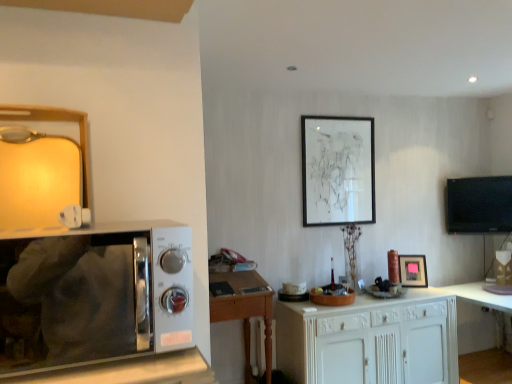
Describe the element at coordinates (244, 310) in the screenshot. I see `wooden desk at center` at that location.

Locate an element on the screen. This screenshot has width=512, height=384. white wood cabinet at center is located at coordinates (370, 340).

Where is `matte black picture frame at center, the 1th picture frame when ordered from bottom to top`? The height and width of the screenshot is (384, 512). matte black picture frame at center, the 1th picture frame when ordered from bottom to top is located at coordinates (413, 270).

Describe the element at coordinates (413, 270) in the screenshot. I see `matte black picture frame at center, which is counted as the 2th picture frame, starting from the left` at that location.

What do you see at coordinates (479, 205) in the screenshot? The height and width of the screenshot is (384, 512). I see `black glossy tv at right` at bounding box center [479, 205].

Locate an element on the screen. Image resolution: width=512 pixels, height=384 pixels. white glossy table at lower right is located at coordinates (481, 296).

Considering the relative sizes of sleek silver microwave at left and black glossy tv at right in the image provided, is sleek silver microwave at left bigger than black glossy tv at right?

Yes.

Does sleek silver microwave at left turn towards black glossy tv at right?

No, sleek silver microwave at left is not turned towards black glossy tv at right.

Can you confirm if sleek silver microwave at left is wider than black glossy tv at right?

Yes.

Who is more distant, sleek silver microwave at left or black glossy tv at right?

Positioned behind is black glossy tv at right.

Between wooden desk at center and matte black picture frame at upper center, which appears as the 1th picture frame when viewed from the left, which one has less height?

Standing shorter between the two is wooden desk at center.

Considering the points (240, 311) and (338, 219), which point is behind, point (240, 311) or point (338, 219)?

The point (338, 219) is more distant.

From the image's perspective, who appears lower, wooden desk at center or matte black picture frame at upper center, which appears as the 1th picture frame when viewed from the left?

wooden desk at center is shown below in the image.

Which object is thinner, wooden desk at center or matte black picture frame at upper center, which is counted as the 1th picture frame, starting from the top?

matte black picture frame at upper center, which is counted as the 1th picture frame, starting from the top.

From a real-world perspective, is white wood cabinet at center positioned above or below matte black picture frame at upper center, which appears as the 1th picture frame when viewed from the left?

From a real-world perspective, white wood cabinet at center is physically below matte black picture frame at upper center, which appears as the 1th picture frame when viewed from the left.

From the picture: Is white wood cabinet at center located outside matte black picture frame at upper center, which appears as the 1th picture frame when viewed from the left?

Yes, white wood cabinet at center is not within matte black picture frame at upper center, which appears as the 1th picture frame when viewed from the left.

Is point (434, 370) more distant than point (352, 187)?

That is False.

Looking at this image, which is more to the left, white wood cabinet at center or matte black picture frame at upper center, which is counted as the 2th picture frame, starting from the bottom?

matte black picture frame at upper center, which is counted as the 2th picture frame, starting from the bottom.

From a real-world perspective, who is located lower, sleek silver microwave at left or matte black picture frame at upper center, which is the 2th picture frame in right-to-left order?

From a 3D spatial view, sleek silver microwave at left is below.

Is sleek silver microwave at left far away from matte black picture frame at upper center, which appears as the 1th picture frame when viewed from the left?

sleek silver microwave at left is positioned a significant distance from matte black picture frame at upper center, which appears as the 1th picture frame when viewed from the left.

Looking at this image, is sleek silver microwave at left outside of matte black picture frame at upper center, which is the 2th picture frame in right-to-left order?

Yes, sleek silver microwave at left is located beyond the bounds of matte black picture frame at upper center, which is the 2th picture frame in right-to-left order.

Between sleek silver microwave at left and matte black picture frame at upper center, which is counted as the 2th picture frame, starting from the bottom, which one is positioned in front?

sleek silver microwave at left.

From the image's perspective, relative to matte black picture frame at upper center, which is counted as the 1th picture frame, starting from the top, is matte black picture frame at center, which is the 1th picture frame in right-to-left order, above or below?

Clearly, from the image's perspective, matte black picture frame at center, which is the 1th picture frame in right-to-left order, is below matte black picture frame at upper center, which is counted as the 1th picture frame, starting from the top.

Image resolution: width=512 pixels, height=384 pixels. What are the coordinates of `picture frame behind the matte black picture frame at center, the 1th picture frame when ordered from bottom to top` in the screenshot? It's located at (338, 170).

Which object is further away from the camera taking this photo, matte black picture frame at center, which is the 1th picture frame in right-to-left order, or matte black picture frame at upper center, which is counted as the 2th picture frame, starting from the bottom?

matte black picture frame at upper center, which is counted as the 2th picture frame, starting from the bottom.

Is matte black picture frame at center, the 1th picture frame when ordered from bottom to top, taller than matte black picture frame at upper center, which is the 2th picture frame in right-to-left order?

In fact, matte black picture frame at center, the 1th picture frame when ordered from bottom to top, may be shorter than matte black picture frame at upper center, which is the 2th picture frame in right-to-left order.

Measure the distance from white glossy table at lower right to matte black picture frame at center, which is counted as the 2th picture frame, starting from the left.

white glossy table at lower right is 46.03 centimeters from matte black picture frame at center, which is counted as the 2th picture frame, starting from the left.

Which of these two, white glossy table at lower right or matte black picture frame at center, which is the 1th picture frame in right-to-left order, is bigger?

white glossy table at lower right.

Does white glossy table at lower right turn towards matte black picture frame at center, which is the second picture frame from top to bottom?

No.

Is white glossy table at lower right taller or shorter than matte black picture frame at center, which is counted as the 2th picture frame, starting from the left?

Considering their sizes, white glossy table at lower right has more height than matte black picture frame at center, which is counted as the 2th picture frame, starting from the left.

Is matte black picture frame at center, which is the second picture frame from top to bottom, in contact with white glossy table at lower right?

No, matte black picture frame at center, which is the second picture frame from top to bottom, is not touching white glossy table at lower right.

Could you tell me if matte black picture frame at center, which is the 1th picture frame in right-to-left order, is turned towards white glossy table at lower right?

No.

Who is bigger, matte black picture frame at center, which is counted as the 2th picture frame, starting from the left, or white glossy table at lower right?

white glossy table at lower right is bigger.

I want to click on microwave oven on the left of black glossy tv at right, so click(x=94, y=294).

From a real-world perspective, which picture frame is the 2nd one above the wooden desk at center? Please provide its 2D coordinates.

[(338, 170)]

Looking at this image, which object lies nearer to the anchor point black glossy tv at right, white glossy table at lower right or wooden desk at center?

Based on the image, white glossy table at lower right appears to be nearer to black glossy tv at right.

Considering their positions, is sleek silver microwave at left positioned further to white glossy table at lower right than black glossy tv at right?

The object further to white glossy table at lower right is sleek silver microwave at left.

Considering their positions, is sleek silver microwave at left positioned further to matte black picture frame at upper center, which is counted as the 1th picture frame, starting from the top, than wooden desk at center?

Among the two, sleek silver microwave at left is located further to matte black picture frame at upper center, which is counted as the 1th picture frame, starting from the top.

Estimate the real-world distances between objects in this image. Which object is closer to sleek silver microwave at left, matte black picture frame at upper center, which is the 2th picture frame in right-to-left order, or matte black picture frame at center, the 1th picture frame when ordered from bottom to top?

Based on the image, matte black picture frame at upper center, which is the 2th picture frame in right-to-left order, appears to be nearer to sleek silver microwave at left.

Considering their positions, is matte black picture frame at center, the 1th picture frame when ordered from bottom to top, positioned closer to sleek silver microwave at left than wooden desk at center?

wooden desk at center is closer to sleek silver microwave at left.

Estimate the real-world distances between objects in this image. Which object is further from white wood cabinet at center, matte black picture frame at upper center, which is the 2th picture frame in right-to-left order, or matte black picture frame at center, which is counted as the 2th picture frame, starting from the left?

Among the two, matte black picture frame at upper center, which is the 2th picture frame in right-to-left order, is located further to white wood cabinet at center.

When comparing their distances from white wood cabinet at center, does wooden desk at center or matte black picture frame at upper center, which is counted as the 1th picture frame, starting from the top, seem further?

Among the two, matte black picture frame at upper center, which is counted as the 1th picture frame, starting from the top, is located further to white wood cabinet at center.

Considering their positions, is matte black picture frame at center, which is counted as the 2th picture frame, starting from the left, positioned further to white wood cabinet at center than black glossy tv at right?

black glossy tv at right is positioned further to the anchor white wood cabinet at center.

The width and height of the screenshot is (512, 384). Identify the location of cabinetry located between wooden desk at center and black glossy tv at right in the left-right direction. (370, 340).

Where is `cabinetry located between sleek silver microwave at left and black glossy tv at right in the depth direction`? cabinetry located between sleek silver microwave at left and black glossy tv at right in the depth direction is located at coordinates (370, 340).

At what (x,y) coordinates should I click in order to perform the action: click on desk located between sleek silver microwave at left and matte black picture frame at upper center, which is counted as the 1th picture frame, starting from the top, in the depth direction. Please return your answer as a coordinate pair (x, y). Looking at the image, I should click on (244, 310).

You are a GUI agent. You are given a task and a screenshot of the screen. Output one action in this format:
    pyautogui.click(x=<x>, y=<y>)
    Task: Click on the television between wooden desk at center and white glossy table at lower right from left to right
    The height and width of the screenshot is (384, 512).
    Given the screenshot: What is the action you would take?
    pyautogui.click(x=479, y=205)